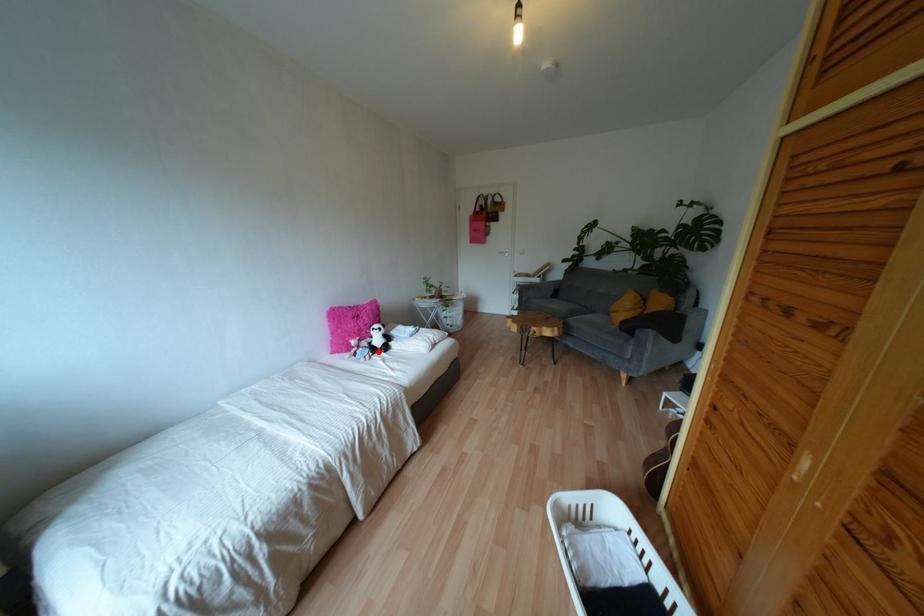
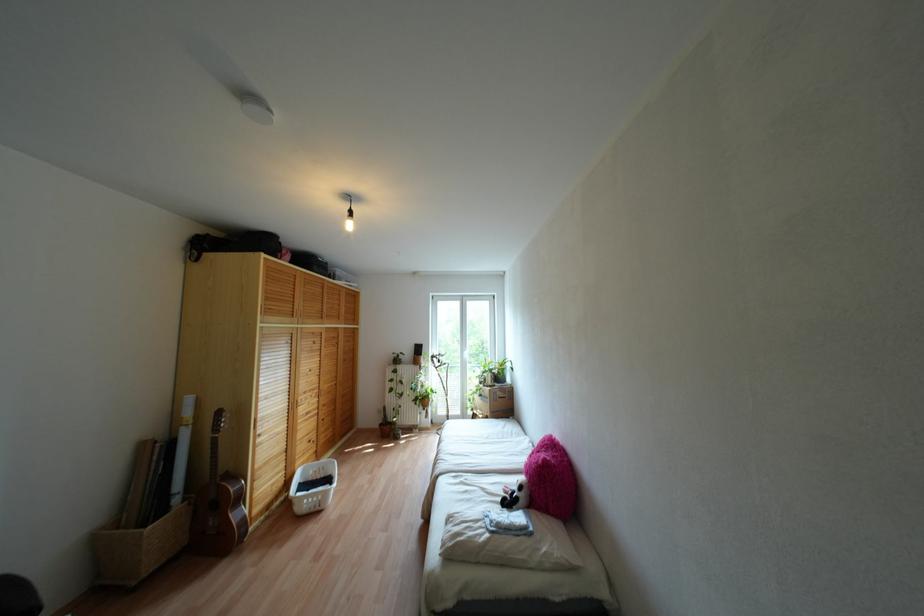
Question: I am providing you with two images of the same scene from different viewpoints. A red point is marked on the first image. Is the red point's position out of view in image 2?

Choices:
 (A) Yes
 (B) No

Answer: (A)